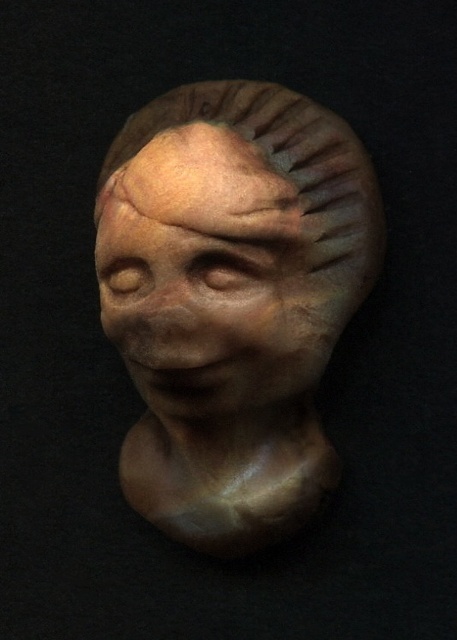
You are an art student analyzing the sculpture in the image. You notice two parts labeled as the matte clay head at center and the matte clay face at center. Which part is located to the right of the other?

The matte clay head at center is positioned on the right side of matte clay face at center.

You are an art curator standing at the origin point of the coordinate system in the image. You need to locate the matte clay head at center. What are its coordinates?

The matte clay head at center is located at coordinates point (x=232, y=301).

You are an art conservator examining the sculpture. You notice two points on the sculpture labeled as point 1 and point 2. Point 1 is at coordinate (196,150) and point 2 is at (221,204). Which point is closer to your eyes?

Point 1 is closer to your eyes because it is further to the camera than point 2.